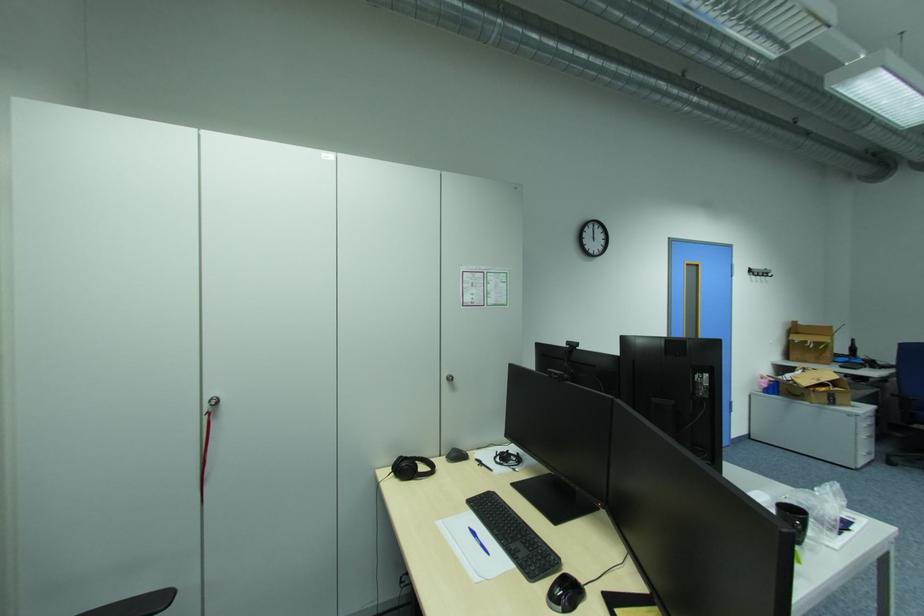
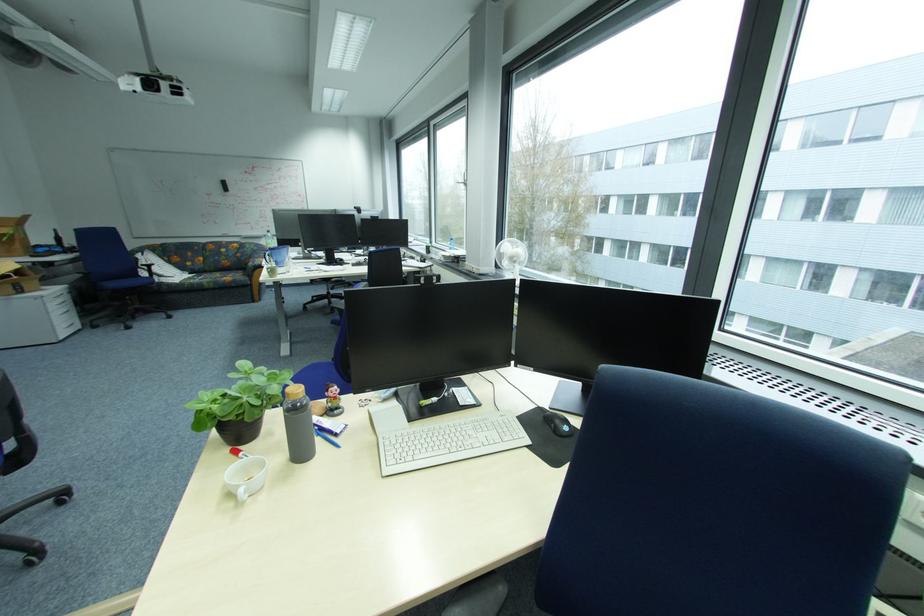
Locate, in the second image, the point that corresponds to pixel 879 454 in the first image.

(80, 326)